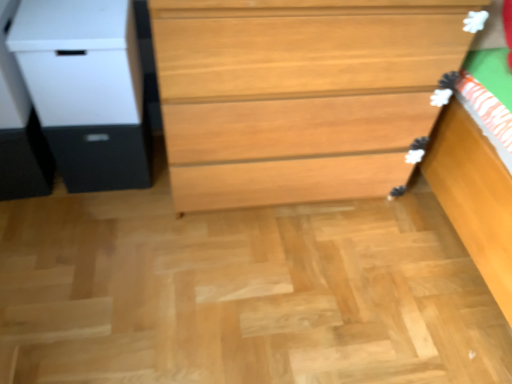
Find the location of `free location above white matte file cabinet at left (from a real-world perspective)`. free location above white matte file cabinet at left (from a real-world perspective) is located at coordinates (73, 9).